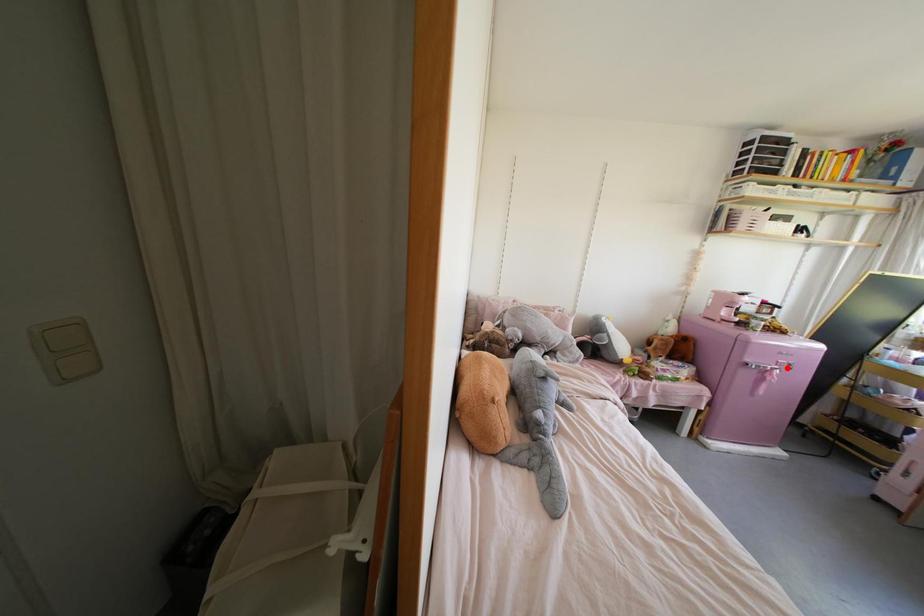
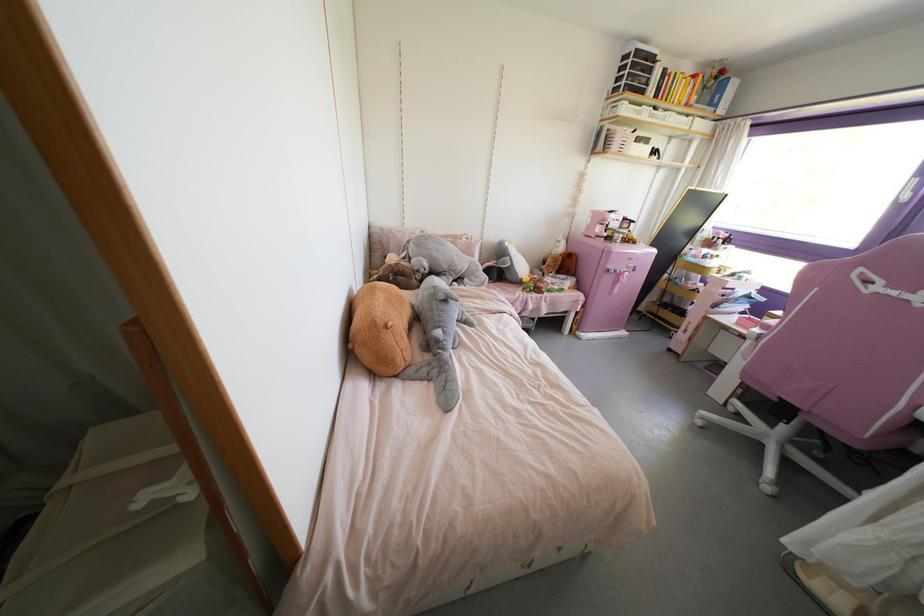
Question: I am providing you with two images of the same scene from different viewpoints. In image1, a red point is highlighted. Considering the same 3D point in image2, which of the following is correct?

Choices:
 (A) It is closer
 (B) It is farther

Answer: (A)